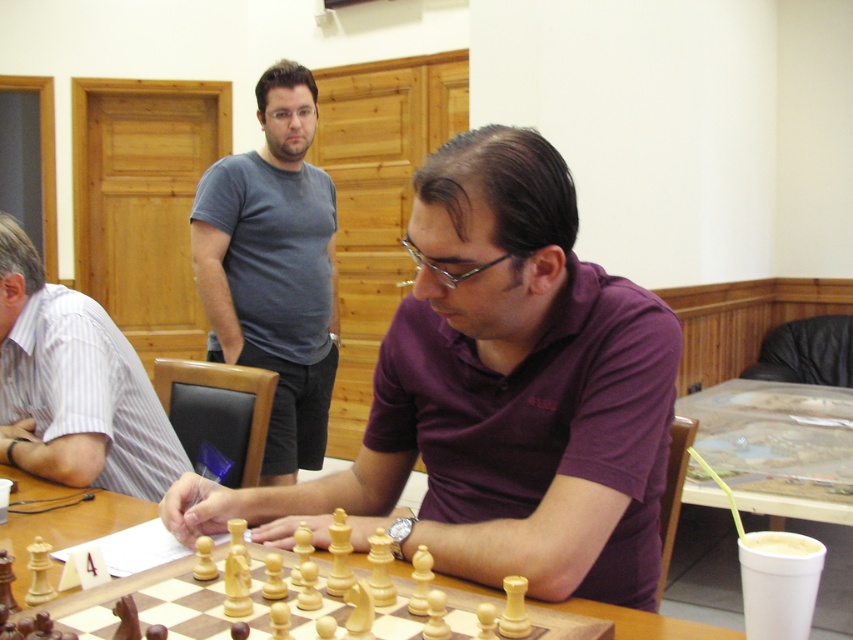
Question: Is gray cotton t-shirt at upper center thinner than wooden chessboard at center?

Choices:
 (A) yes
 (B) no

Answer: (B)

Question: Which point appears closest to the camera in this image?

Choices:
 (A) (440, 529)
 (B) (276, 221)

Answer: (A)

Question: Among these objects, which one is farthest from the camera?

Choices:
 (A) wooden chessboard at center
 (B) purple cotton shirt at center

Answer: (A)

Question: Can you confirm if purple cotton shirt at center is smaller than gray cotton t-shirt at upper center?

Choices:
 (A) yes
 (B) no

Answer: (A)

Question: Can you confirm if purple cotton shirt at center is positioned below gray cotton t-shirt at upper center?

Choices:
 (A) yes
 (B) no

Answer: (A)

Question: Which point is closer to the camera taking this photo?

Choices:
 (A) (331, 264)
 (B) (317, 492)
 (C) (78, 509)
 (D) (65, 444)

Answer: (B)